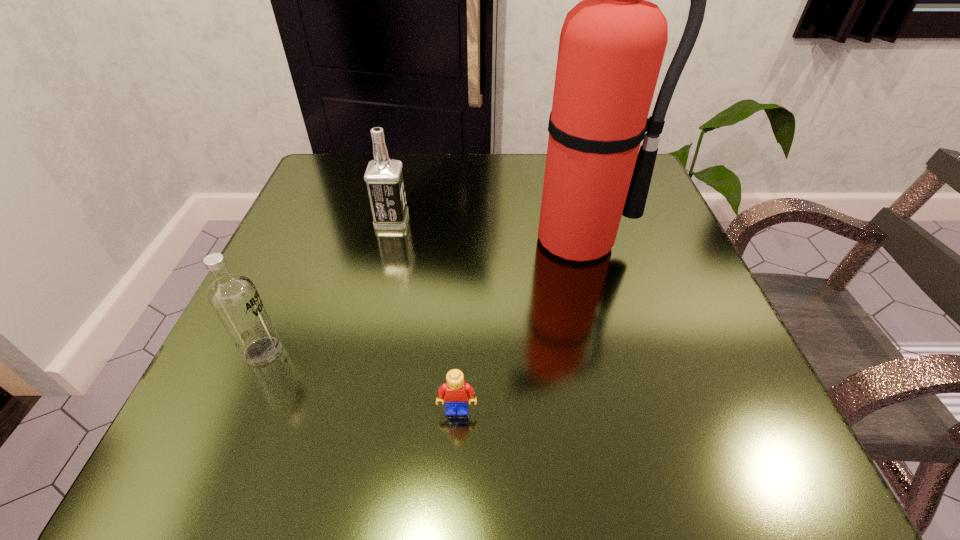
Find the location of a particular element. This screenshot has height=540, width=960. free point between the right vodka and the rightmost object is located at coordinates (485, 231).

Find the location of a particular element. This screenshot has height=540, width=960. free spot between the second object from left to right and the tallest object is located at coordinates (485, 231).

Image resolution: width=960 pixels, height=540 pixels. I want to click on the closest object to the nearest object, so point(233,297).

Locate which object ranks third in proximity to the farther vodka. Please provide its 2D coordinates. Your answer should be formatted as a tuple, i.e. [(x, y)], where the tuple contains the x and y coordinates of a point satisfying the conditions above.

[(455, 391)]

This screenshot has width=960, height=540. Identify the location of free spot that satisfies the following two spatial constraints: 1. at the nozzle of the tallest object; 2. on the front label of the nearer vodka. (606, 352).